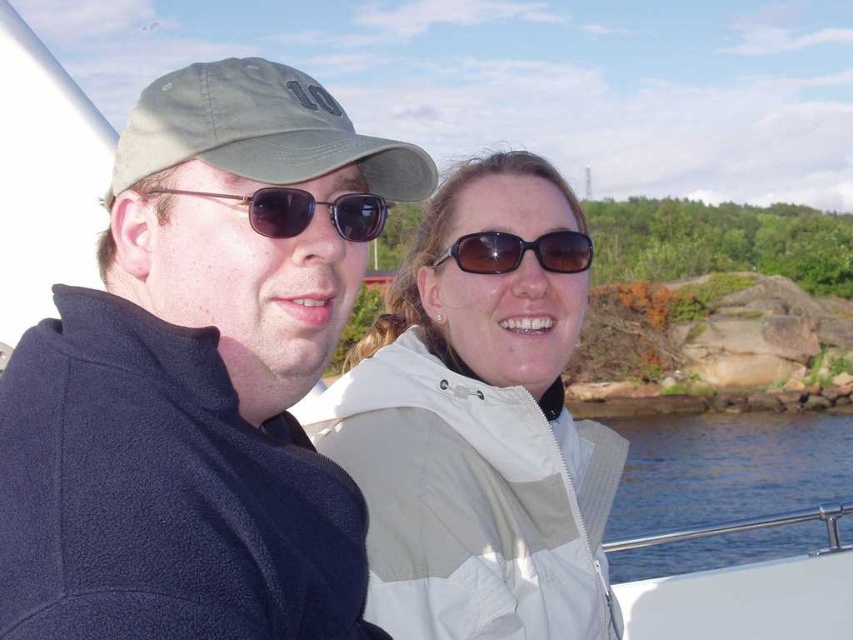
Which of these two, green fabric baseball cap at upper left or shiny dark brown sunglasses at center, stands shorter?

shiny dark brown sunglasses at center

Does green fabric baseball cap at upper left have a greater width compared to shiny dark brown sunglasses at center?

Yes, green fabric baseball cap at upper left is wider than shiny dark brown sunglasses at center.

Find the location of a particular element. Image resolution: width=853 pixels, height=640 pixels. green fabric baseball cap at upper left is located at coordinates (259, 131).

Is dark blue fleece jacket at left thinner than white matte jacket at center?

Indeed, dark blue fleece jacket at left has a lesser width compared to white matte jacket at center.

Does point (270, 236) come in front of point (445, 396)?

Yes, point (270, 236) is closer to viewer.

Where is `dark blue fleece jacket at left`? dark blue fleece jacket at left is located at coordinates (199, 376).

Does dark blue fleece jacket at left have a lesser height compared to blue water at lower right?

Correct, dark blue fleece jacket at left is not as tall as blue water at lower right.

Which of these two, dark blue fleece jacket at left or blue water at lower right, stands shorter?

With less height is dark blue fleece jacket at left.

The image size is (853, 640). What are the coordinates of `dark blue fleece jacket at left` in the screenshot? It's located at (199, 376).

Identify the location of dark blue fleece jacket at left. point(199,376).